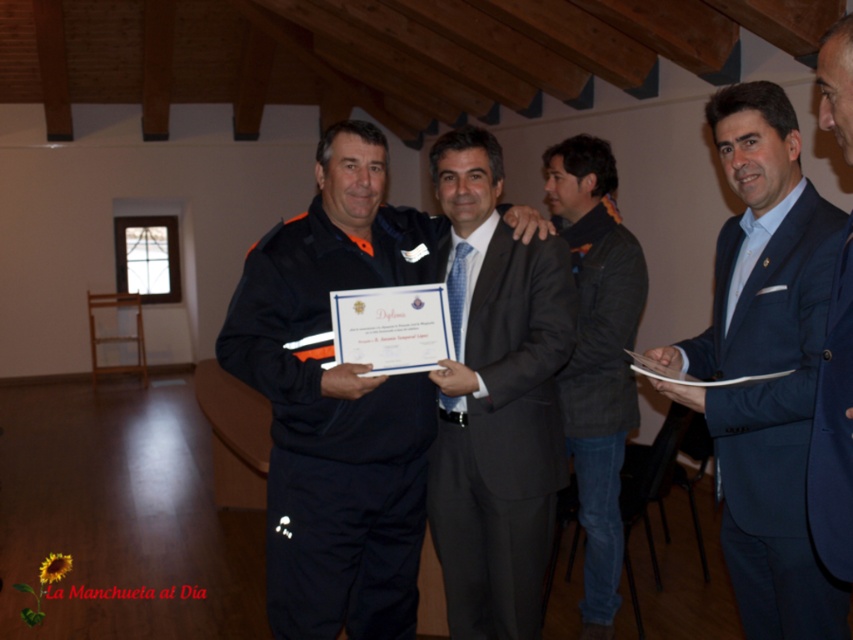
Question: Is dark gray textured jacket at center bigger than blue fabric suit at center?

Choices:
 (A) yes
 (B) no

Answer: (A)

Question: Which is nearer to the blue fabric suit at center?

Choices:
 (A) dark gray suit at center
 (B) blue suit at right
 (C) matte black uniform at center
 (D) dark gray textured jacket at center

Answer: (B)

Question: Estimate the real-world distances between objects in this image. Which object is farther from the blue fabric suit at center?

Choices:
 (A) blue suit at right
 (B) matte black uniform at center

Answer: (B)

Question: Can you confirm if blue suit at right is positioned to the right of dark gray textured jacket at center?

Choices:
 (A) no
 (B) yes

Answer: (B)

Question: Which of the following is the farthest from the observer?

Choices:
 (A) blue fabric suit at center
 (B) blue suit at right

Answer: (B)

Question: Does dark gray suit at center appear under blue fabric suit at center?

Choices:
 (A) no
 (B) yes

Answer: (B)